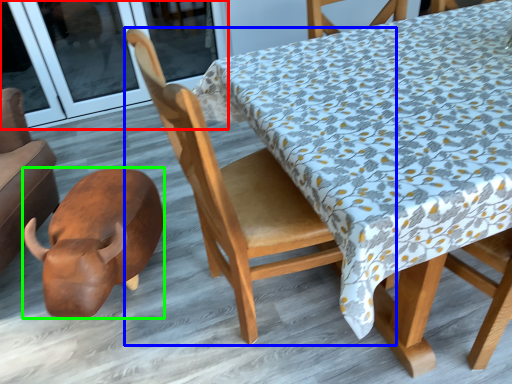
Question: Considering the real-world distances, which object is farthest from screen door (highlighted by a red box)? chair (highlighted by a blue box) or animal (highlighted by a green box)?

Choices:
 (A) chair
 (B) animal

Answer: (A)